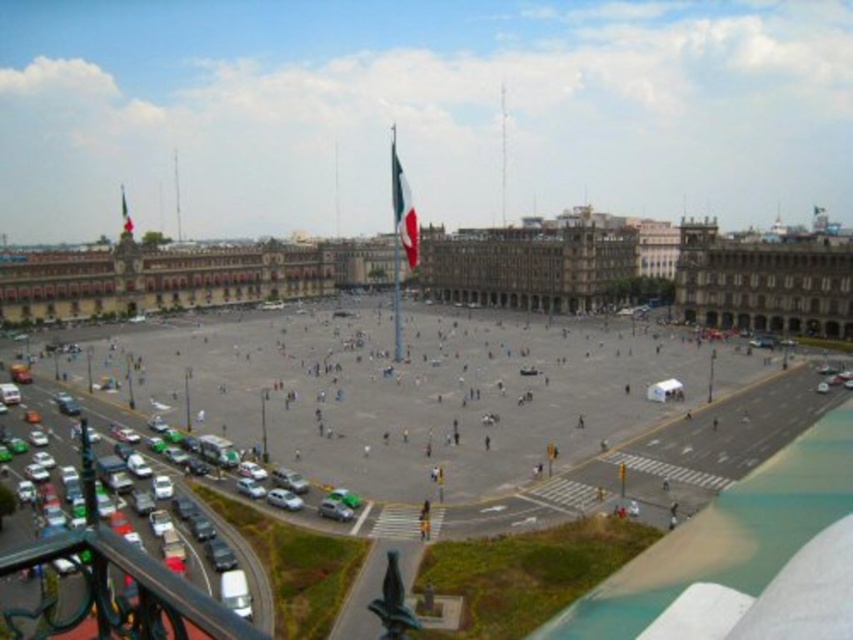
Between red fabric flag at center and green fabric flag at upper center, which one has less height?

green fabric flag at upper center

Which of these two, red fabric flag at center or green fabric flag at upper center, stands taller?

red fabric flag at center is taller.

Which is behind, point (412, 260) or point (122, 208)?

Positioned behind is point (122, 208).

You are a GUI agent. You are given a task and a screenshot of the screen. Output one action in this format:
    pyautogui.click(x=<x>, y=<y>)
    Task: Click on the red fabric flag at center
    
    Given the screenshot: What is the action you would take?
    pyautogui.click(x=403, y=211)

Can you confirm if brown stone building at center is positioned below green fabric flag at upper center?

Correct, brown stone building at center is located below green fabric flag at upper center.

Between brown stone building at center and green fabric flag at upper center, which one appears on the left side from the viewer's perspective?

green fabric flag at upper center

Locate an element on the screen. The image size is (853, 640). brown stone building at center is located at coordinates (764, 284).

Can you confirm if brown stone building at center is positioned to the left of red fabric flag at center?

In fact, brown stone building at center is to the right of red fabric flag at center.

Does brown stone building at center appear over red fabric flag at center?

No, brown stone building at center is not above red fabric flag at center.

Which is in front, point (846, 275) or point (392, 196)?

Point (846, 275) is more forward.

At what (x,y) coordinates should I click in order to perform the action: click on brown stone building at center. Please return your answer as a coordinate pair (x, y). Looking at the image, I should click on (764, 284).